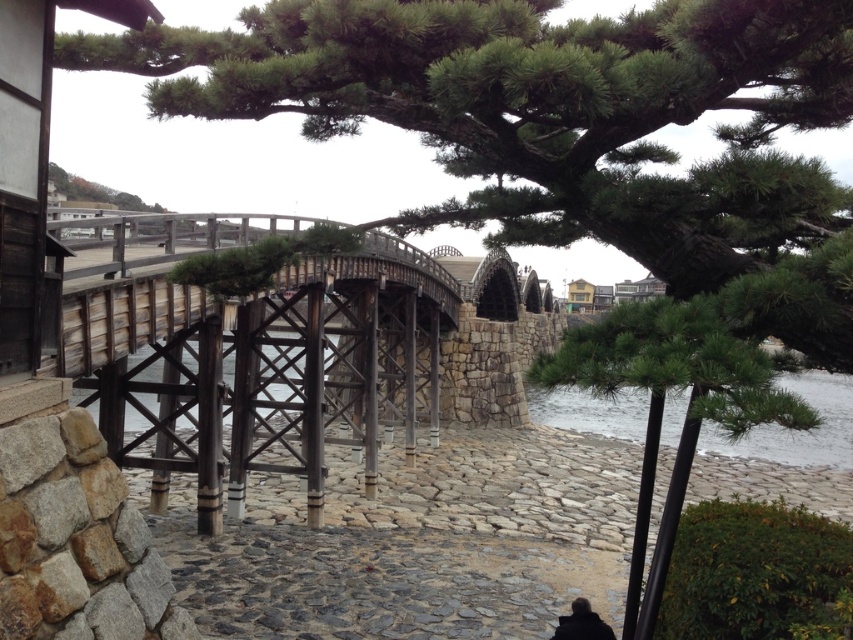
Question: Can you confirm if clear water at lower right is positioned to the right of black matte person at lower right?

Choices:
 (A) yes
 (B) no

Answer: (A)

Question: In this image, where is clear water at lower right located relative to black matte person at lower right?

Choices:
 (A) right
 (B) left

Answer: (A)

Question: Is clear water at lower right thinner than black matte person at lower right?

Choices:
 (A) no
 (B) yes

Answer: (A)

Question: Among these objects, which one is farthest from the camera?

Choices:
 (A) clear water at lower right
 (B) black matte person at lower right

Answer: (B)

Question: Which point appears farthest from the camera in this image?

Choices:
 (A) (560, 618)
 (B) (647, 401)

Answer: (B)